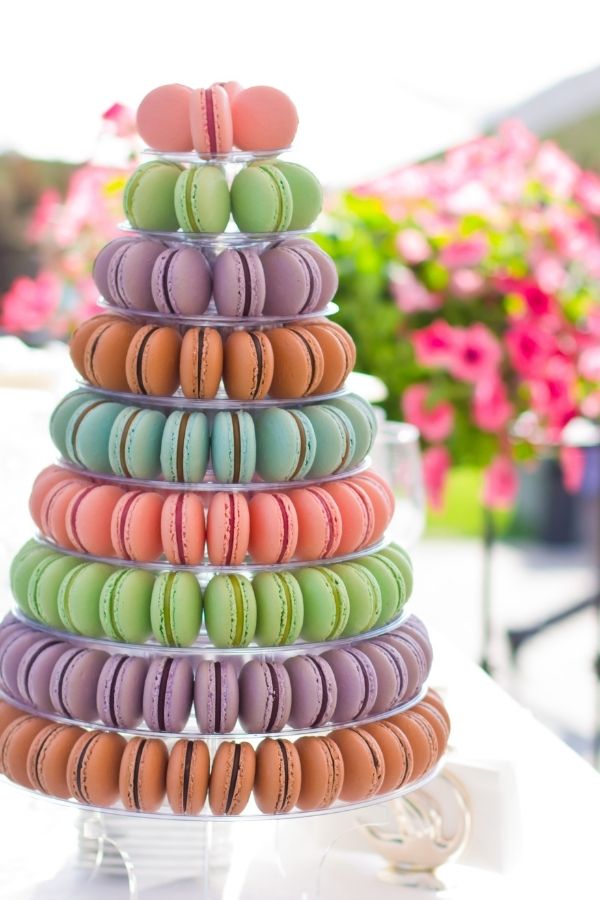
Locate an element on the screen. This screenshot has width=600, height=900. table is located at coordinates (516, 822).